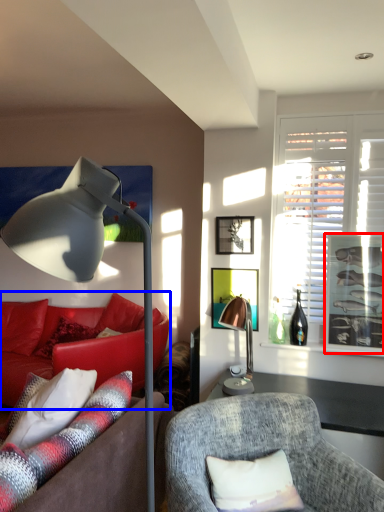
Question: Which object is closer to the camera taking this photo, picture frame (highlighted by a red box) or studio couch (highlighted by a blue box)?

Choices:
 (A) picture frame
 (B) studio couch

Answer: (A)